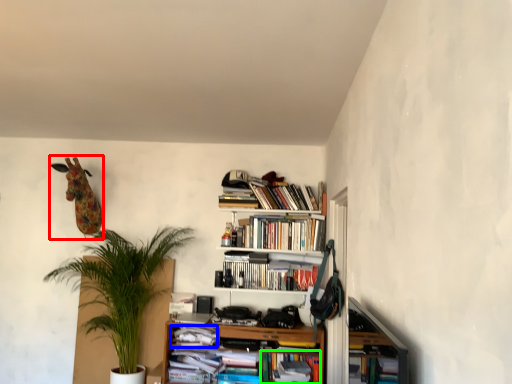
Question: Which object is positioned closest to animal (highlighted by a red box)? Select from book (highlighted by a blue box) and book (highlighted by a green box).

Choices:
 (A) book
 (B) book

Answer: (A)